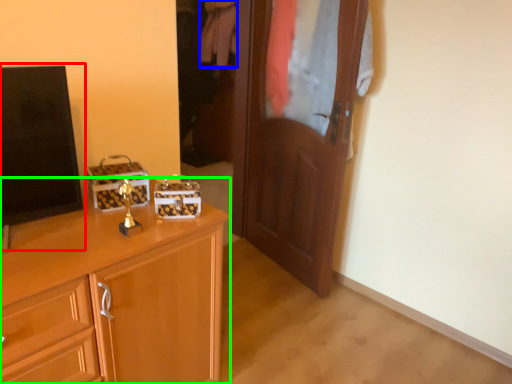
Question: Based on their relative distances, which object is farther from tv show (highlighted by a red box)? Choose from clothing (highlighted by a blue box) and cabinetry (highlighted by a green box).

Choices:
 (A) clothing
 (B) cabinetry

Answer: (A)